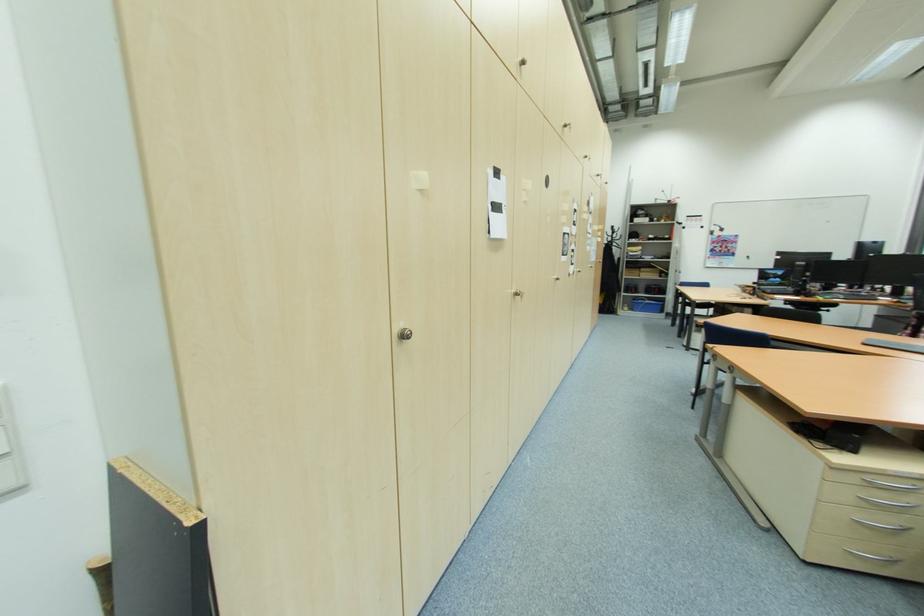
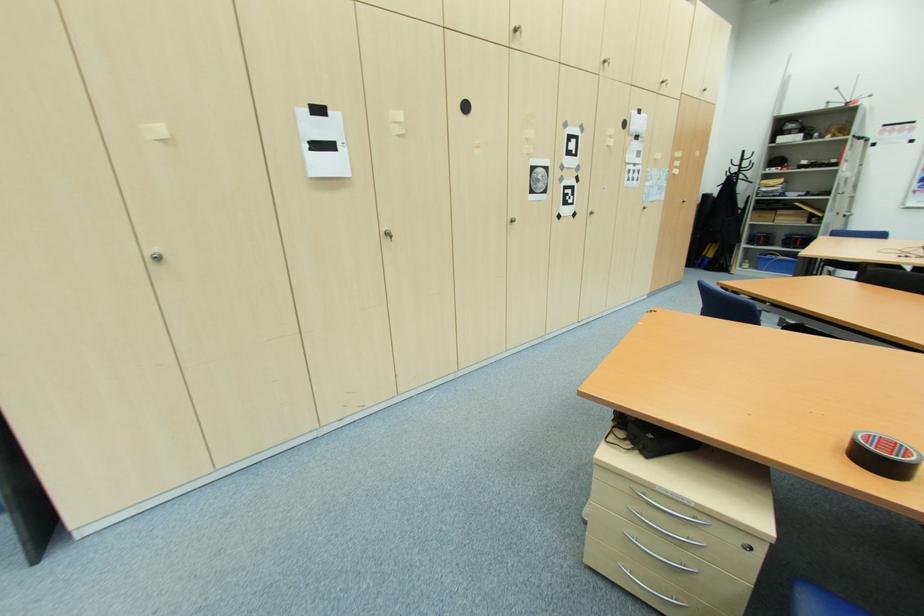
Question: In a continuous first-person perspective shot, in which direction is the camera moving?

Choices:
 (A) Left
 (B) Right
 (C) Forward
 (D) Backward

Answer: (B)